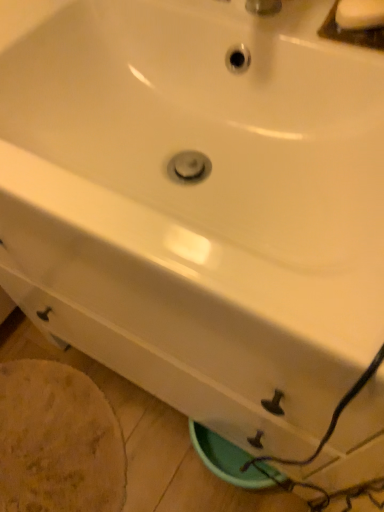
The height and width of the screenshot is (512, 384). In order to click on free region on the left part of white matte soap at upper right in this screenshot , I will do `click(276, 23)`.